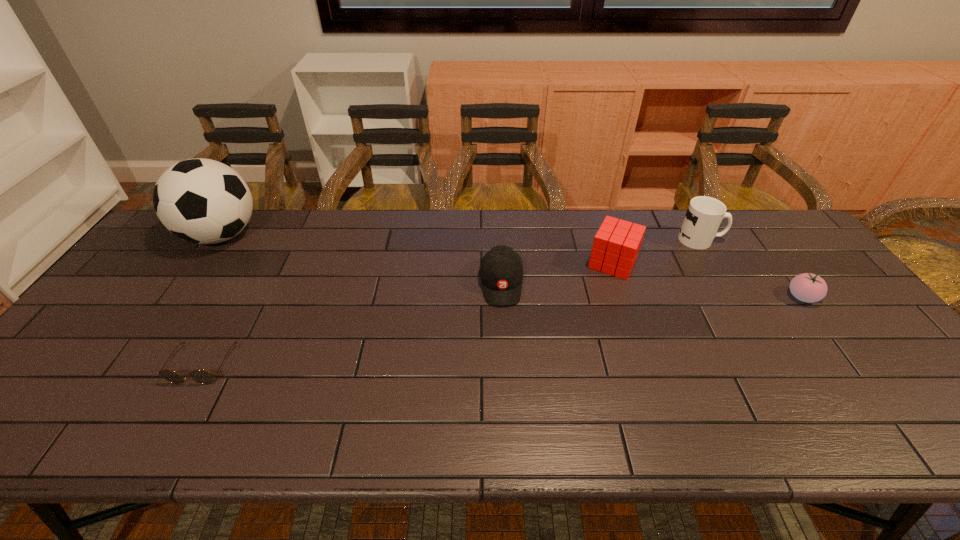
The height and width of the screenshot is (540, 960). I want to click on object present at the far left corner, so click(203, 201).

At what (x,y) coordinates should I click in order to perform the action: click on vacant region at the far edge. Please return your answer as a coordinate pair (x, y). Looking at the image, I should click on (357, 230).

In order to click on vacant area at the near edge in this screenshot , I will do `click(522, 447)`.

Locate an element on the screen. The width and height of the screenshot is (960, 540). vacant space at the left edge of the desktop is located at coordinates (116, 293).

Locate an element on the screen. This screenshot has width=960, height=540. vacant area at the right edge of the desktop is located at coordinates (870, 356).

In the image, there is a desktop. Where is `free space at the near left corner`? free space at the near left corner is located at coordinates (31, 416).

What are the coordinates of `vacant area that lies between the tallest object and the sunglasses` in the screenshot? It's located at 212,300.

Where is `vacant area that lies between the nearest object and the baseball cap`? This screenshot has height=540, width=960. vacant area that lies between the nearest object and the baseball cap is located at coordinates (352, 324).

You are a GUI agent. You are given a task and a screenshot of the screen. Output one action in this format:
    pyautogui.click(x=<x>, y=<y>)
    Task: Click on the empty space that is in between the baseball cap and the soccer ball
    This screenshot has height=540, width=960.
    Given the screenshot: What is the action you would take?
    pyautogui.click(x=362, y=260)

The width and height of the screenshot is (960, 540). Identify the location of vacant point located between the rightmost object and the fourth object from left to right. (708, 280).